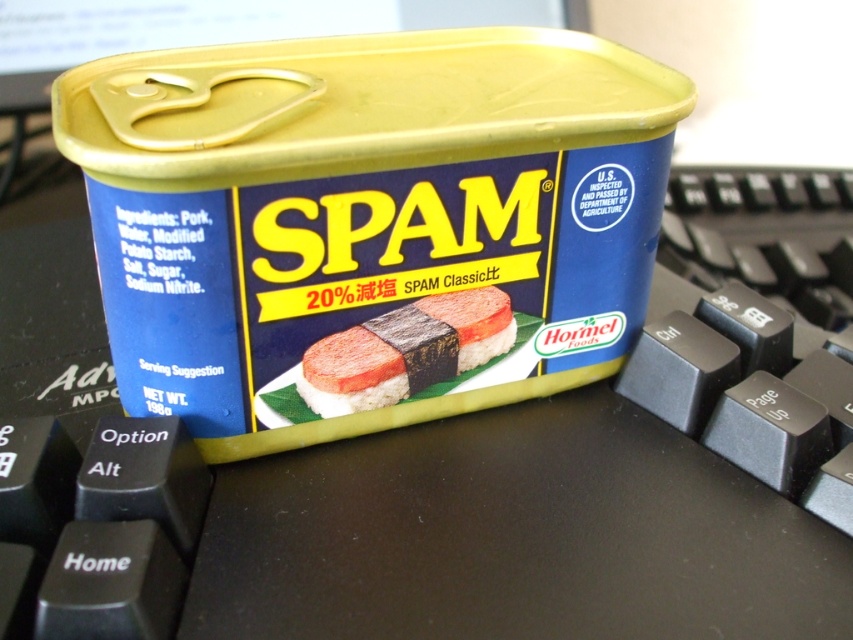
You are a photographer trying to capture the SPAM can on the keyboard. You notice two points marked on the can. Which point, point [86,145] or point [334,355], is closer to your camera lens?

Point [86,145] is closer to the camera lens than point [334,355].